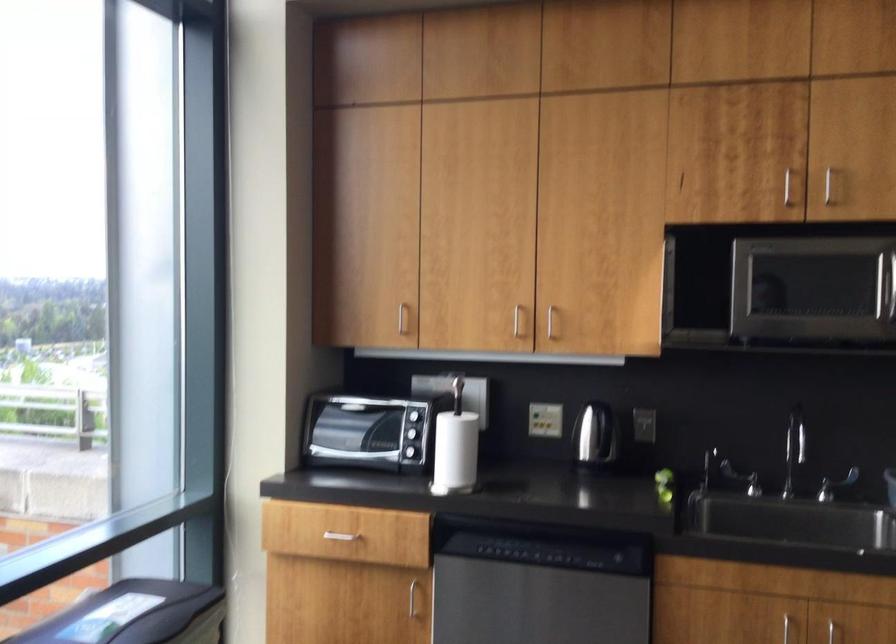
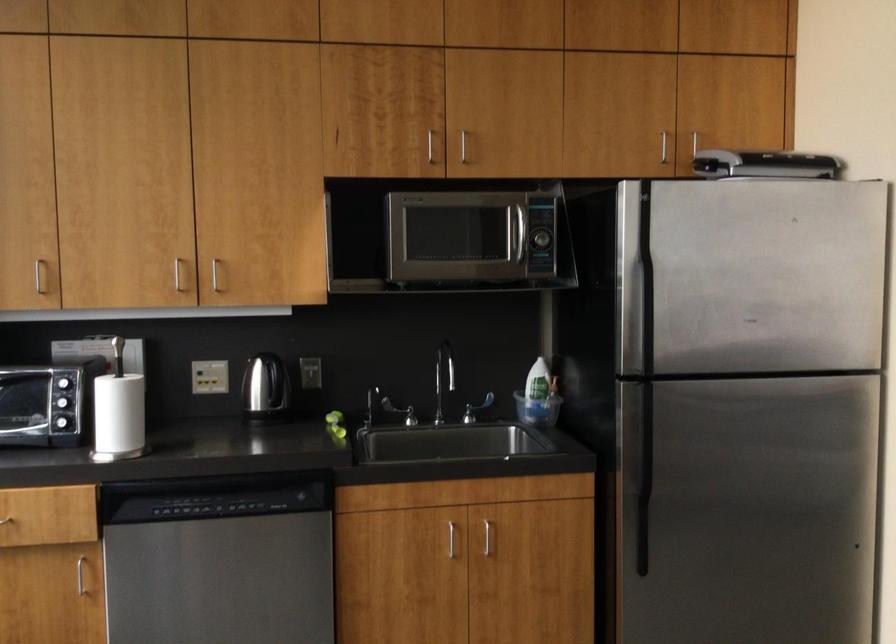
Question: The camera is either moving clockwise (left) or counter-clockwise (right) around the object. The first image is from the beginning of the video and the second image is from the end. Is the camera moving left or right when shooting the video?

Choices:
 (A) Left
 (B) Right

Answer: (A)